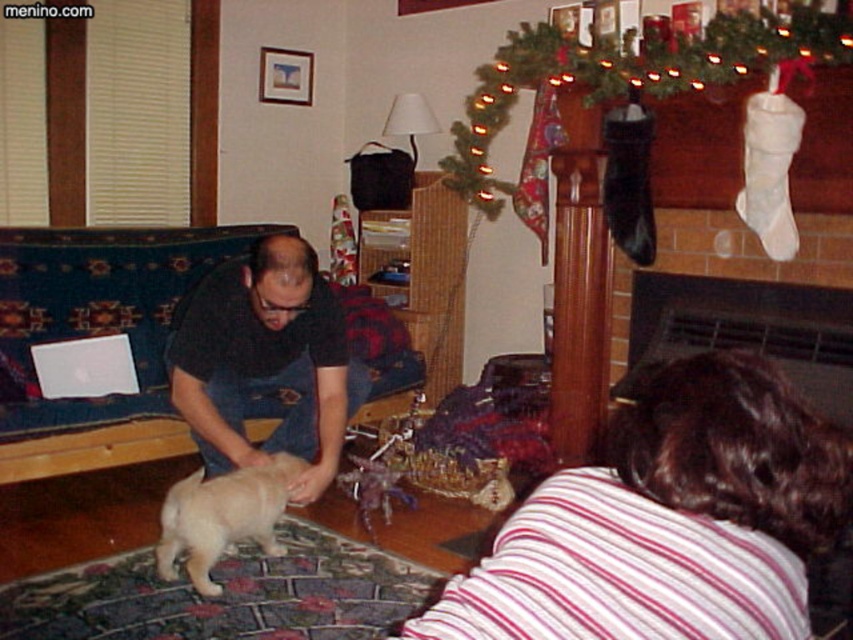
Between dark blue denim apron at center and light beige fur at center, which one has more height?

dark blue denim apron at center is taller.

How much distance is there between dark blue denim apron at center and light beige fur at center?

A distance of 11.99 inches exists between dark blue denim apron at center and light beige fur at center.

The height and width of the screenshot is (640, 853). Describe the element at coordinates (265, 360) in the screenshot. I see `dark blue denim apron at center` at that location.

You are a GUI agent. You are given a task and a screenshot of the screen. Output one action in this format:
    pyautogui.click(x=<x>, y=<y>)
    Task: Click on the dark blue denim apron at center
    Image resolution: width=853 pixels, height=640 pixels.
    Given the screenshot: What is the action you would take?
    point(265,360)

Is point (129, 403) in front of point (202, 477)?

Yes, point (129, 403) is closer to viewer.

Is the position of blue fabric couch at left more distant than that of light beige fur at center?

Yes, blue fabric couch at left is further from the viewer.

Which is behind, point (65, 294) or point (198, 545)?

The point (65, 294) is more distant.

The height and width of the screenshot is (640, 853). I want to click on blue fabric couch at left, so click(x=97, y=333).

Consider the image. Is white striped shirt at lower right taller than light beige fur at center?

No, white striped shirt at lower right is not taller than light beige fur at center.

Is white striped shirt at lower right smaller than light beige fur at center?

Yes.

The width and height of the screenshot is (853, 640). I want to click on white striped shirt at lower right, so click(668, 518).